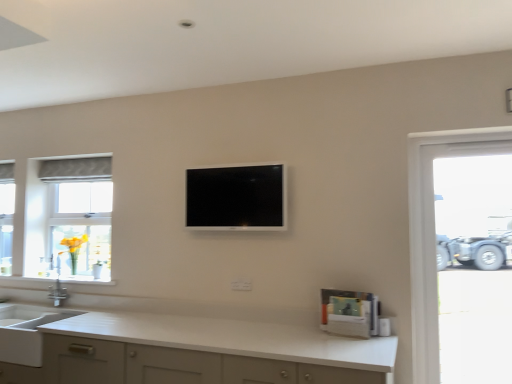
Where is `vacant space to the left of silver metallic faucet at left`? The image size is (512, 384). vacant space to the left of silver metallic faucet at left is located at coordinates (27, 274).